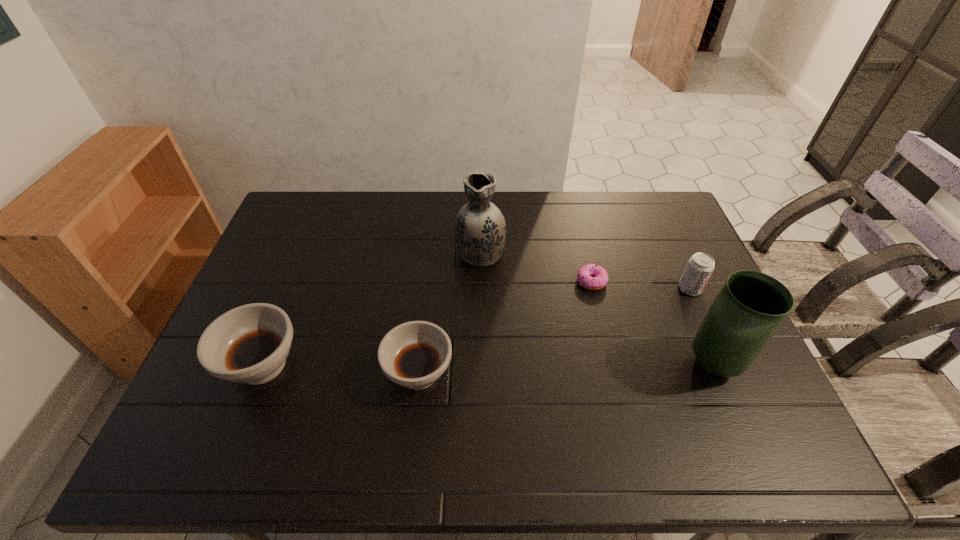
Locate an element on the screen. The height and width of the screenshot is (540, 960). free space that satisfies the following two spatial constraints: 1. on the back side of the right vase; 2. on the right side of the soda can is located at coordinates (681, 289).

At what (x,y) coordinates should I click in order to perform the action: click on vacant region that satisfies the following two spatial constraints: 1. on the back side of the soda can; 2. on the left side of the right vase. Please return your answer as a coordinate pair (x, y). Looking at the image, I should click on (681, 289).